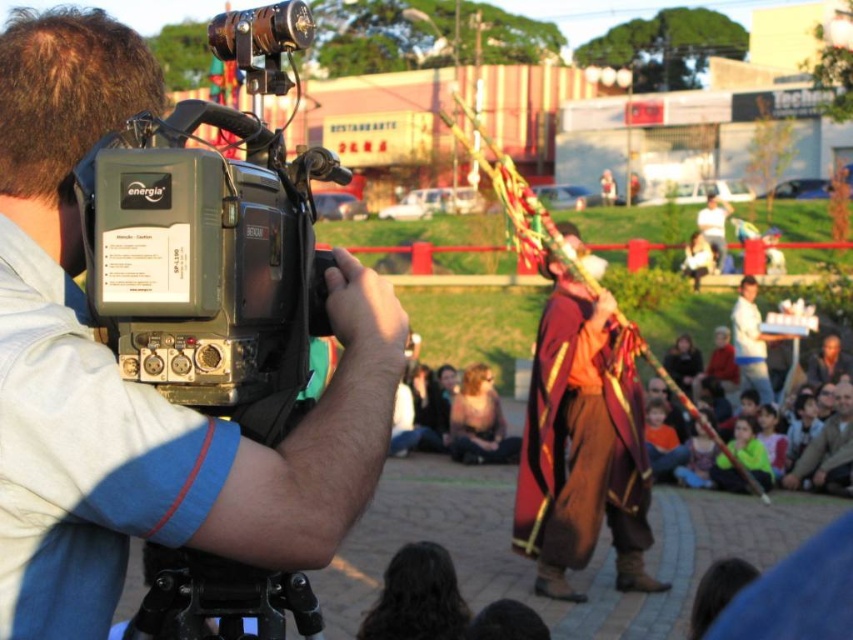
Question: Is matte black camera at upper left further to the viewer compared to velvet maroon cape at center?

Choices:
 (A) no
 (B) yes

Answer: (A)

Question: Which object is positioned farthest from the velvet maroon cape at center?

Choices:
 (A) matte black camera at upper left
 (B) black plastic camera at left

Answer: (A)

Question: Is matte black camera at upper left to the right of velvet maroon cape at center from the viewer's perspective?

Choices:
 (A) yes
 (B) no

Answer: (B)

Question: Which point is farther to the camera?

Choices:
 (A) (262, 221)
 (B) (398, 336)
 (C) (606, 515)

Answer: (C)

Question: Which of the following is the farthest from the observer?

Choices:
 (A) black plastic camera at left
 (B) velvet maroon cape at center
 (C) matte black camera at upper left

Answer: (B)

Question: In this image, where is matte black camera at upper left located relative to black plastic camera at left?

Choices:
 (A) right
 (B) left

Answer: (B)